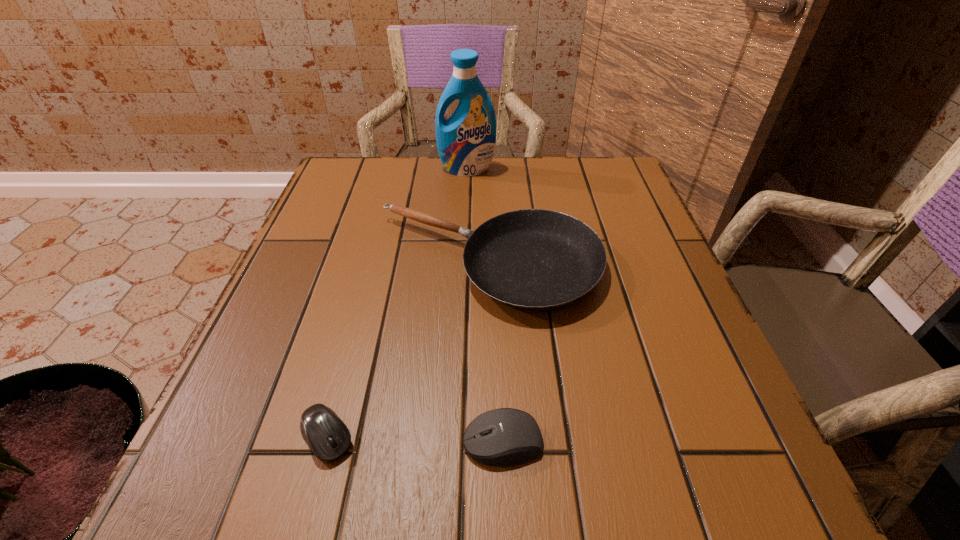
Where is `vacant space in between the third nearest object and the detergent`? The image size is (960, 540). vacant space in between the third nearest object and the detergent is located at coordinates (477, 216).

Identify the location of free space between the right computer equipment and the left computer equipment. (415, 440).

Locate an element on the screen. The height and width of the screenshot is (540, 960). blank region between the left computer equipment and the frying pan is located at coordinates (407, 350).

You are a GUI agent. You are given a task and a screenshot of the screen. Output one action in this format:
    pyautogui.click(x=<x>, y=<y>)
    Task: Click on the vacant area that lies between the tallest object and the right computer equipment
    Image resolution: width=960 pixels, height=540 pixels.
    Given the screenshot: What is the action you would take?
    pyautogui.click(x=485, y=306)

Where is `empty space between the detergent and the left computer equipment`? The image size is (960, 540). empty space between the detergent and the left computer equipment is located at coordinates (397, 303).

Where is `vacant area that lies between the left computer equipment and the farthest object`? vacant area that lies between the left computer equipment and the farthest object is located at coordinates (397, 303).

Locate an element on the screen. free space between the third shortest object and the left computer equipment is located at coordinates (407, 350).

The height and width of the screenshot is (540, 960). Find the location of `free space between the third nearest object and the right computer equipment`. free space between the third nearest object and the right computer equipment is located at coordinates (495, 353).

The height and width of the screenshot is (540, 960). What are the coordinates of `free space between the right computer equipment and the left computer equipment` in the screenshot? It's located at (415, 440).

Identify which object is the closest to the frying pan. Please provide its 2D coordinates. Your answer should be formatted as a tuple, i.e. [(x, y)], where the tuple contains the x and y coordinates of a point satisfying the conditions above.

[(326, 434)]